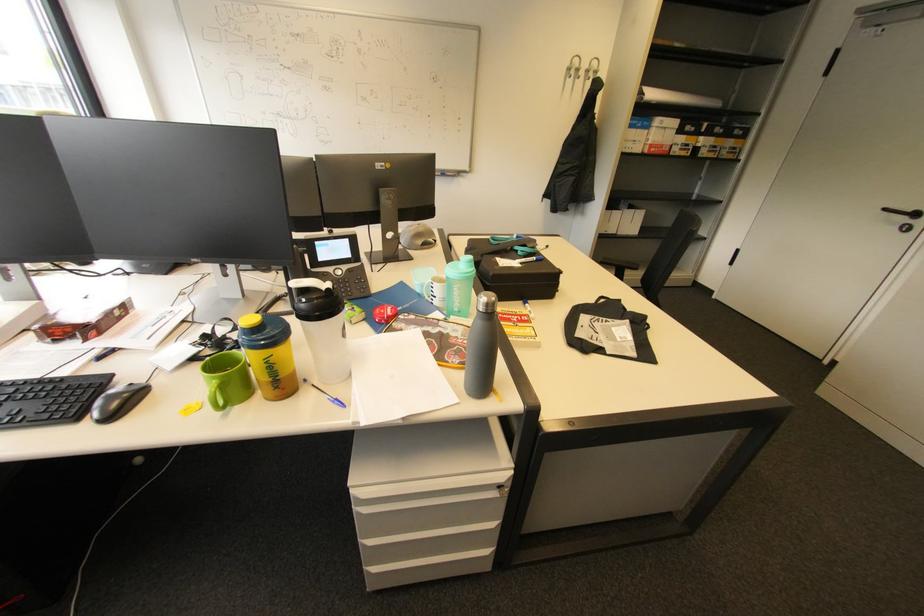
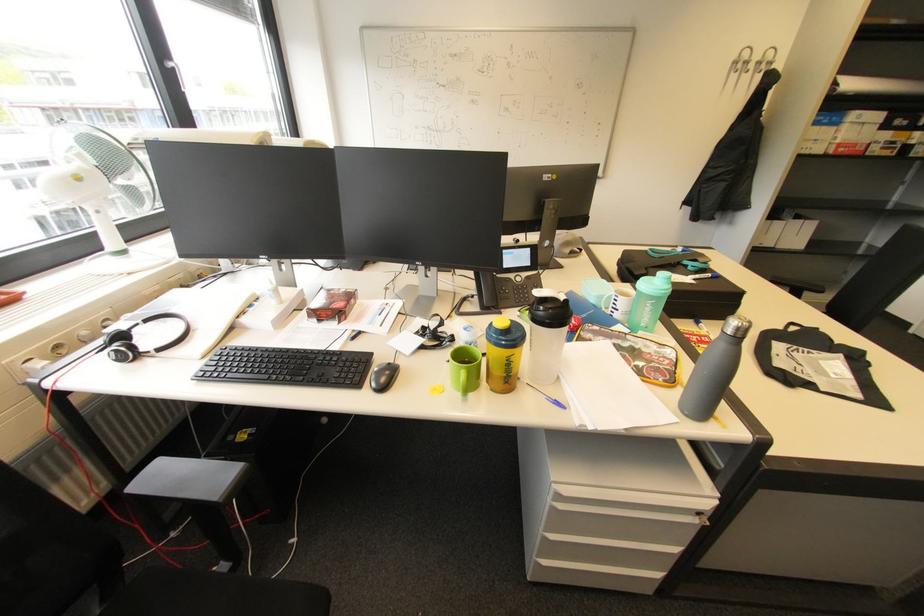
Locate, in the second image, the point that corresponds to (492,310) in the first image.

(739, 334)